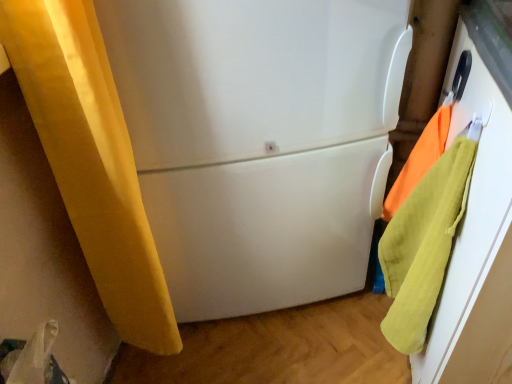
Question: Can you confirm if white glossy refrigerator at center is taller than soft yellow towel at right, positioned as the first beach towel in bottom-to-top order?

Choices:
 (A) no
 (B) yes

Answer: (B)

Question: Can you confirm if white glossy refrigerator at center is shorter than soft yellow towel at right, positioned as the first beach towel in bottom-to-top order?

Choices:
 (A) yes
 (B) no

Answer: (B)

Question: From a real-world perspective, is white glossy refrigerator at center physically above soft yellow towel at right, marked as the second beach towel in a top-to-bottom arrangement?

Choices:
 (A) yes
 (B) no

Answer: (A)

Question: Does white glossy refrigerator at center have a lesser width compared to soft yellow towel at right, positioned as the first beach towel in bottom-to-top order?

Choices:
 (A) no
 (B) yes

Answer: (A)

Question: Can you confirm if white glossy refrigerator at center is smaller than soft yellow towel at right, marked as the second beach towel in a top-to-bottom arrangement?

Choices:
 (A) no
 (B) yes

Answer: (A)

Question: Is white glossy refrigerator at center far from soft yellow towel at right, positioned as the first beach towel in bottom-to-top order?

Choices:
 (A) yes
 (B) no

Answer: (B)

Question: Would you say orange cotton towel at right, which appears as the 2th beach towel when ordered from the bottom, is outside soft yellow towel at right, marked as the second beach towel in a top-to-bottom arrangement?

Choices:
 (A) no
 (B) yes

Answer: (B)

Question: Is orange cotton towel at right, which appears as the 2th beach towel when ordered from the bottom, looking in the opposite direction of soft yellow towel at right, positioned as the first beach towel in bottom-to-top order?

Choices:
 (A) yes
 (B) no

Answer: (B)

Question: Could soft yellow towel at right, marked as the second beach towel in a top-to-bottom arrangement, be considered to be inside orange cotton towel at right, which appears as the 2th beach towel when ordered from the bottom?

Choices:
 (A) yes
 (B) no

Answer: (B)

Question: Is orange cotton towel at right, which is the 1th beach towel from top to bottom, taller than soft yellow towel at right, positioned as the first beach towel in bottom-to-top order?

Choices:
 (A) yes
 (B) no

Answer: (B)

Question: Is orange cotton towel at right, which is the 1th beach towel from top to bottom, facing towards soft yellow towel at right, positioned as the first beach towel in bottom-to-top order?

Choices:
 (A) yes
 (B) no

Answer: (A)

Question: From a real-world perspective, is orange cotton towel at right, which is the 1th beach towel from top to bottom, positioned over soft yellow towel at right, positioned as the first beach towel in bottom-to-top order, based on gravity?

Choices:
 (A) yes
 (B) no

Answer: (A)

Question: Is orange cotton towel at right, which appears as the 2th beach towel when ordered from the bottom, looking in the opposite direction of white glossy refrigerator at center?

Choices:
 (A) yes
 (B) no

Answer: (B)